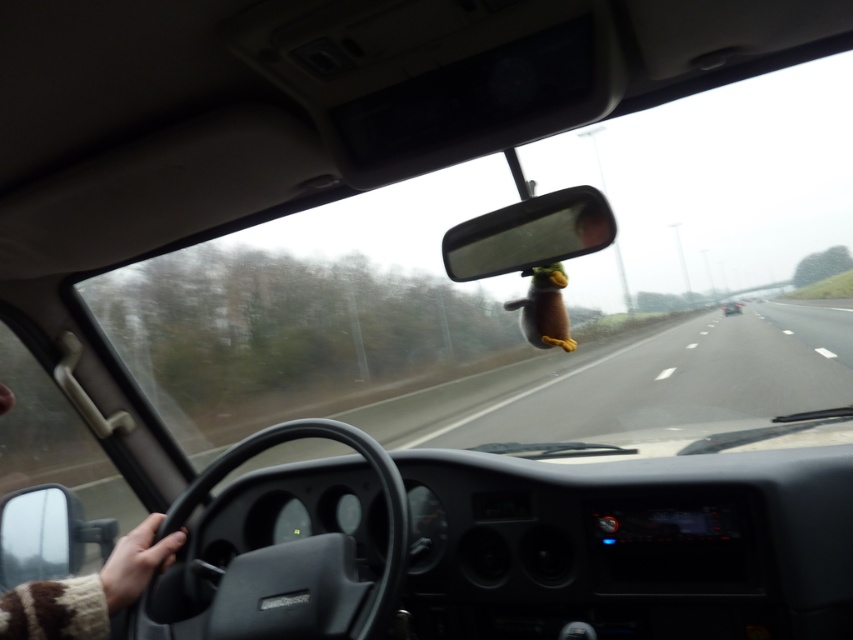
Question: Which of the following is the closest to the observer?

Choices:
 (A) (469, 240)
 (B) (653, 396)
 (C) (728, 308)

Answer: (A)

Question: Can you confirm if clear plastic view mirror at center is positioned above matte black car at center?

Choices:
 (A) yes
 (B) no

Answer: (B)

Question: Is clear plastic view mirror at center bigger than matte black car at center?

Choices:
 (A) yes
 (B) no

Answer: (B)

Question: Considering the relative positions of transparent glass windshield at center and matte black car at center in the image provided, where is transparent glass windshield at center located with respect to matte black car at center?

Choices:
 (A) above
 (B) below

Answer: (A)

Question: Which of these objects is positioned closest to the matte black car at center?

Choices:
 (A) clear plastic view mirror at center
 (B) transparent glass windshield at center

Answer: (B)

Question: Which point is closer to the camera?

Choices:
 (A) (741, 342)
 (B) (575, 189)

Answer: (B)